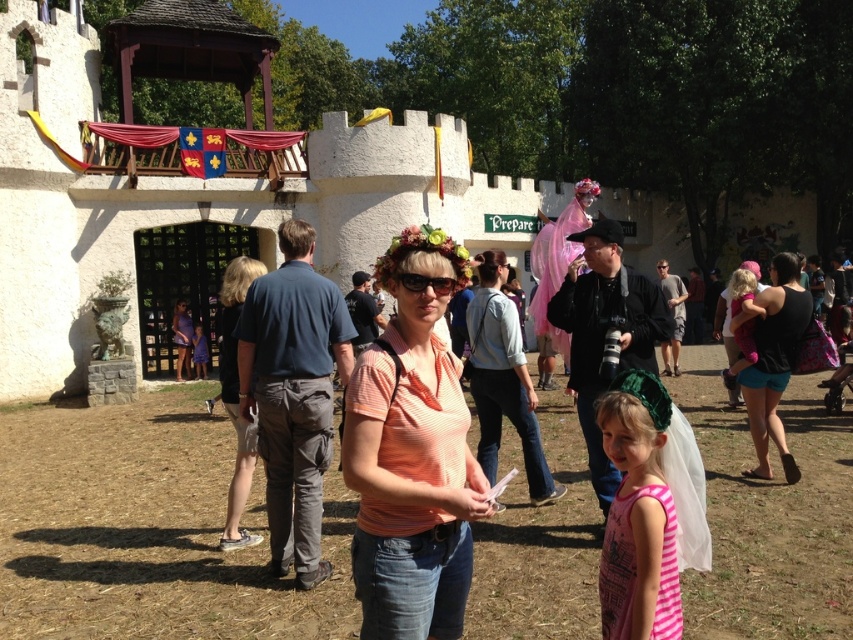
Between pink striped dress at lower right and pink fabric dress at center, which one has more height?

With more height is pink striped dress at lower right.

Does pink striped dress at lower right have a lesser width compared to pink fabric dress at center?

No, pink striped dress at lower right is not thinner than pink fabric dress at center.

At what (x,y) coordinates should I click in order to perform the action: click on pink striped dress at lower right. Please return your answer as a coordinate pair (x, y). Looking at the image, I should click on pyautogui.click(x=639, y=515).

Is pink striped dress at lower right wider than denim shorts at center?

Incorrect, pink striped dress at lower right's width does not surpass denim shorts at center's.

Where is `pink striped dress at lower right`? pink striped dress at lower right is located at coordinates (639, 515).

Identify the location of pink striped dress at lower right. Image resolution: width=853 pixels, height=640 pixels. click(639, 515).

Which is below, orange striped shirt at center or pink fabric dress at center?

orange striped shirt at center is lower down.

Who is shorter, orange striped shirt at center or pink fabric dress at center?

With less height is orange striped shirt at center.

The width and height of the screenshot is (853, 640). I want to click on orange striped shirt at center, so click(x=412, y=452).

Identify the location of orange striped shirt at center. (412, 452).